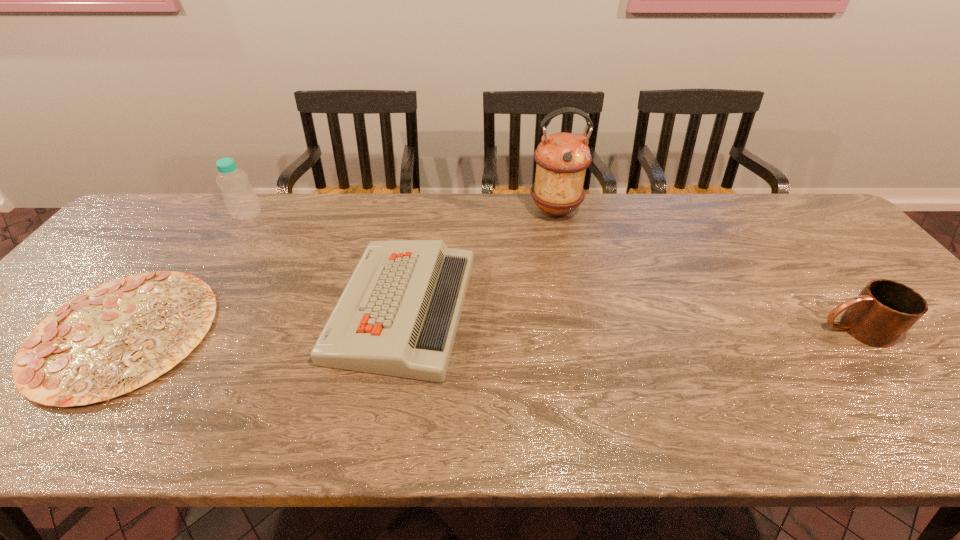
You are a GUI agent. You are given a task and a screenshot of the screen. Output one action in this format:
    pyautogui.click(x=<x>, y=<y>)
    Task: Click on the tallest object
    This screenshot has width=960, height=540.
    Given the screenshot: What is the action you would take?
    pyautogui.click(x=562, y=158)

Locate an element on the screen. oil lamp is located at coordinates (562, 158).

Locate an element on the screen. This screenshot has width=960, height=540. bottle is located at coordinates (240, 198).

The height and width of the screenshot is (540, 960). In order to click on mug in this screenshot , I will do `click(885, 310)`.

You are a GUI agent. You are given a task and a screenshot of the screen. Output one action in this format:
    pyautogui.click(x=<x>, y=<y>)
    Task: Click on the rightmost object
    Image resolution: width=960 pixels, height=540 pixels.
    Given the screenshot: What is the action you would take?
    pyautogui.click(x=885, y=310)

Where is `the third object from left to right`? The height and width of the screenshot is (540, 960). the third object from left to right is located at coordinates (398, 315).

Identify the location of computer keyboard. Image resolution: width=960 pixels, height=540 pixels. (398, 315).

This screenshot has height=540, width=960. In order to click on vacant region located on the left of the fourth object from left to right in this screenshot , I will do `click(412, 211)`.

Where is `free space located on the front of the bottle`? This screenshot has width=960, height=540. free space located on the front of the bottle is located at coordinates (199, 291).

This screenshot has height=540, width=960. In order to click on vacant space located 0.230m on the side of the rightmost object with the handle in this screenshot , I will do `click(722, 329)`.